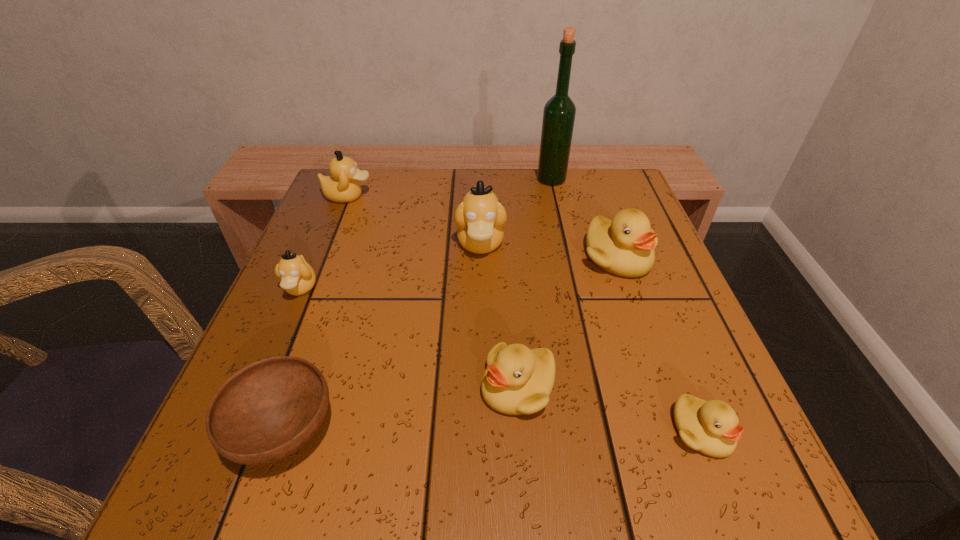
Where is `liquor that is at the far edge`? liquor that is at the far edge is located at coordinates (559, 112).

Identify the location of duckling present at the far edge. (342, 186).

Where is `bowl present at the near edge`? Image resolution: width=960 pixels, height=540 pixels. bowl present at the near edge is located at coordinates (266, 411).

In order to click on duckling located at the near edge in this screenshot , I will do `click(711, 427)`.

Locate an element on the screen. Image resolution: width=960 pixels, height=540 pixels. bowl that is positioned at the left edge is located at coordinates (266, 411).

Where is `liquor present at the right edge`? The image size is (960, 540). liquor present at the right edge is located at coordinates (559, 112).

At what (x,y) coordinates should I click in order to perform the action: click on object that is at the far left corner. Please return your answer as a coordinate pair (x, y). The width and height of the screenshot is (960, 540). Looking at the image, I should click on (342, 186).

The width and height of the screenshot is (960, 540). I want to click on object that is at the near left corner, so click(x=266, y=411).

In order to click on object located in the far right corner section of the desktop in this screenshot , I will do `click(559, 112)`.

The height and width of the screenshot is (540, 960). What are the coordinates of `object that is positioned at the near right corner` in the screenshot? It's located at (711, 427).